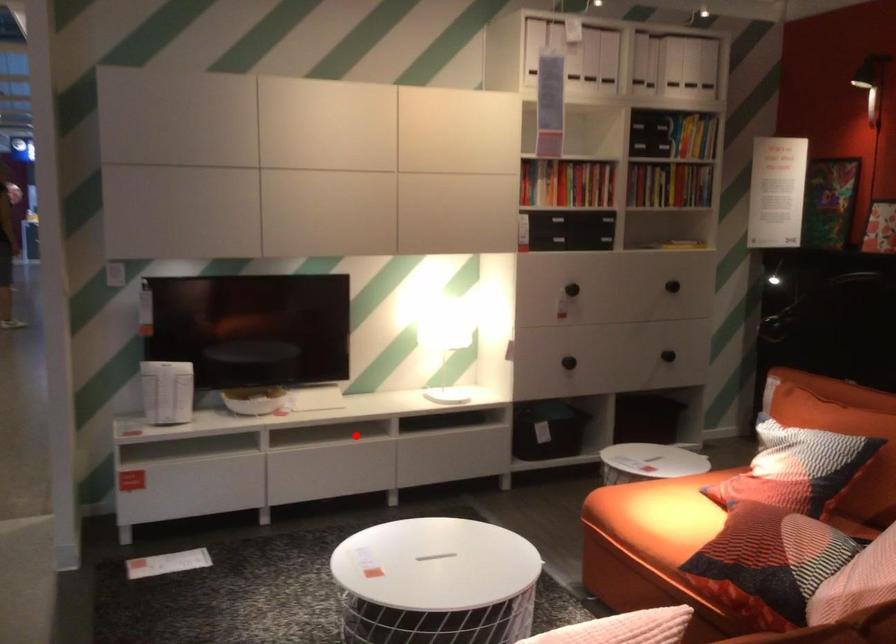
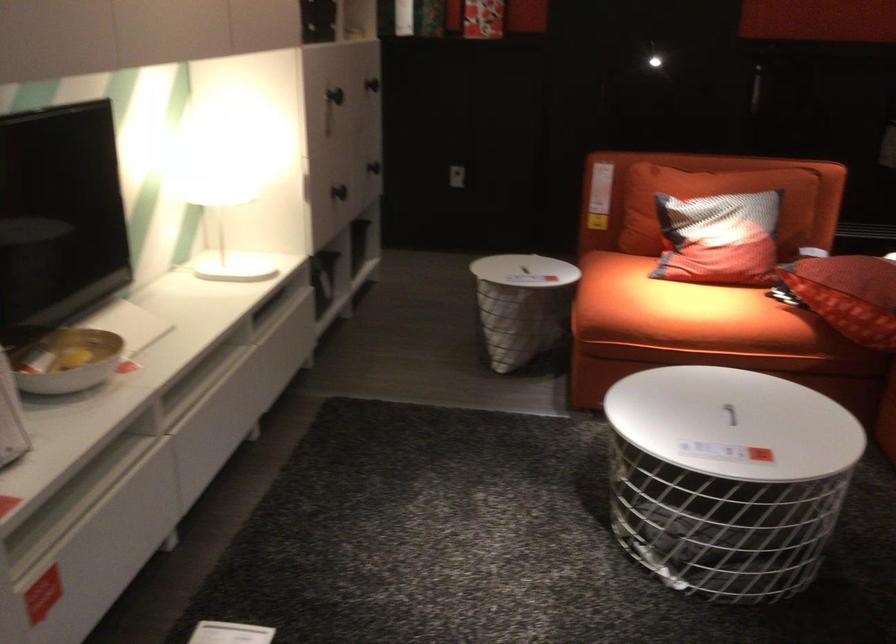
Question: I am providing you with two images of the same scene from different viewpoints. A red point is shown in image1. For the corresponding object point in image2, is it positioned nearer or farther from the camera?

Choices:
 (A) Nearer
 (B) Farther

Answer: (A)